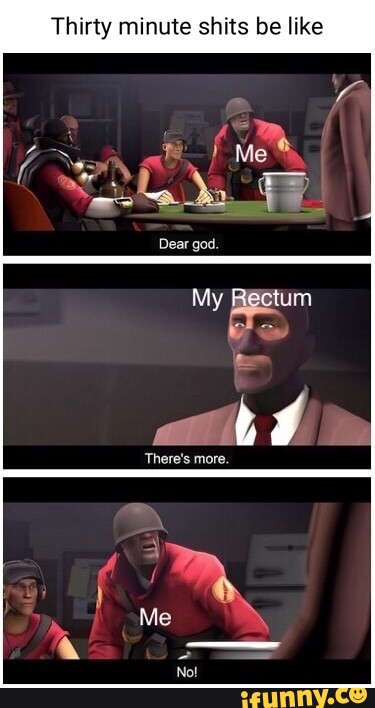
Identify the location of fridge. The image size is (375, 708). (313, 107), (265, 565).